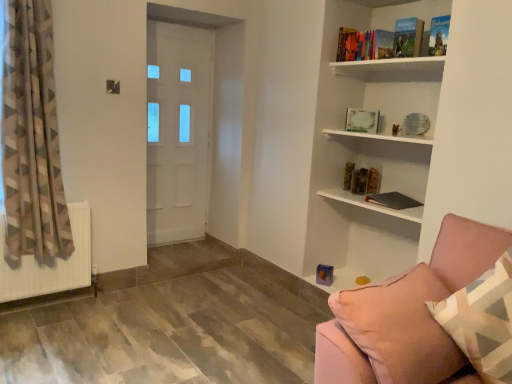
Question: Is point (373, 297) positioned closer to the camera than point (38, 289)?

Choices:
 (A) closer
 (B) farther

Answer: (A)

Question: Considering the positions of pink fabric couch at lower right and white matte radiator at lower left in the image, is pink fabric couch at lower right wider or thinner than white matte radiator at lower left?

Choices:
 (A) thin
 (B) wide

Answer: (B)

Question: Estimate the real-world distances between objects in this image. Which object is closer to the hardcover book at upper right, which appears as the fifth book when ordered from the bottom?

Choices:
 (A) pink fabric couch at lower right
 (B) matte black book at center
 (C) white glossy door at center
 (D) white matte radiator at lower left
 (E) pink fabric pillow at lower right

Answer: (B)

Question: Which of these objects is positioned closest to the hardcover book at upper right, arranged as the third book when viewed from the top?

Choices:
 (A) hardcover book at upper right, the 6th book positioned from the bottom
 (B) matte black book at center
 (C) white matte radiator at lower left
 (D) hardcover book at upper right, which appears as the fifth book when ordered from the bottom
 (E) pink fabric couch at lower right

Answer: (D)